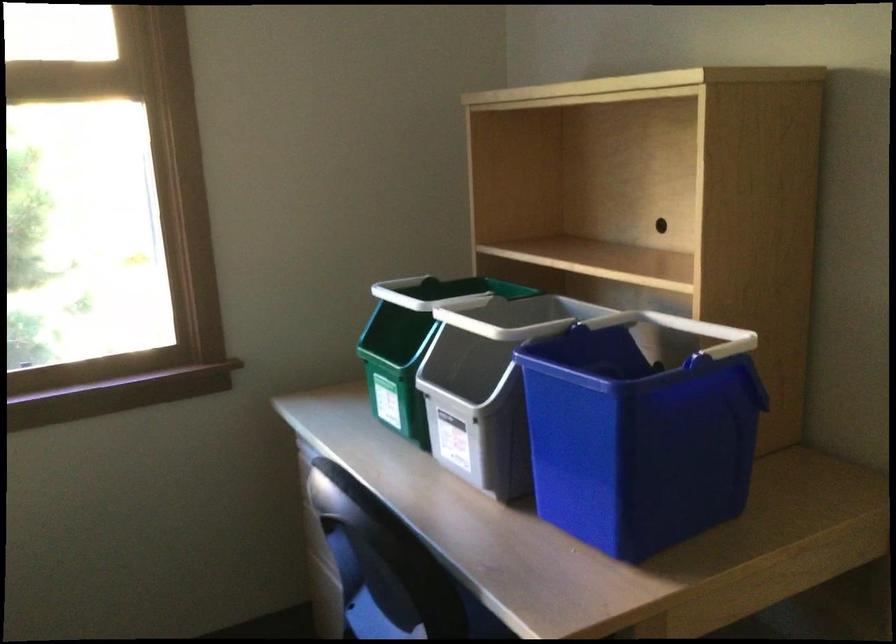
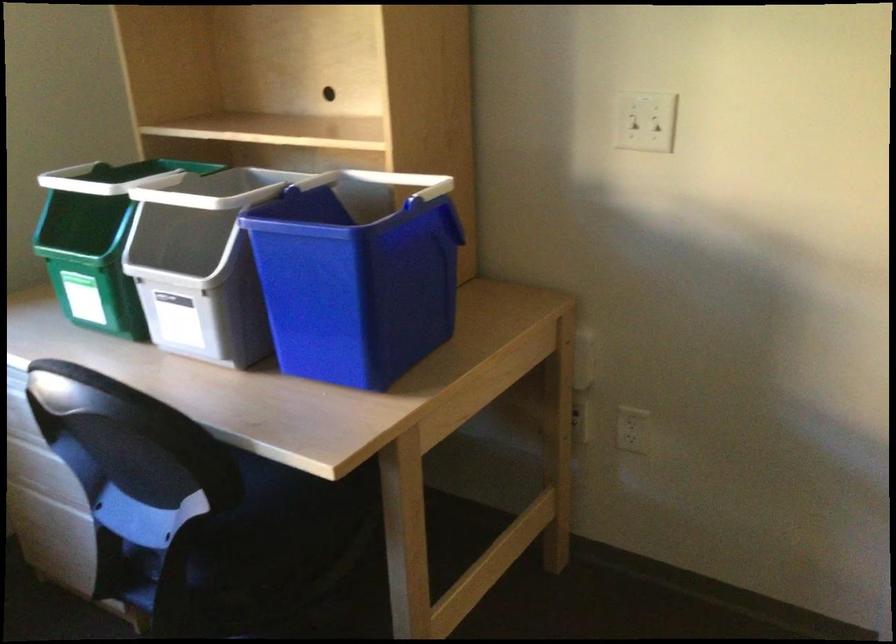
In the second image, find the point that corresponds to point (440, 290) in the first image.

(116, 178)